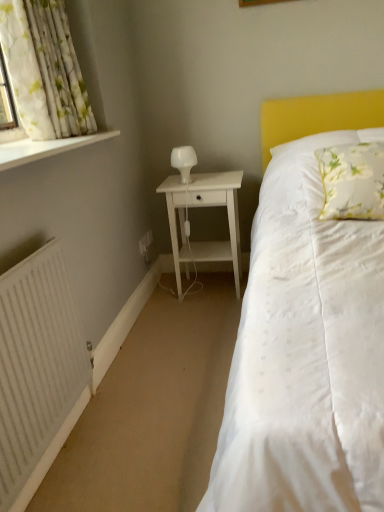
Question: Is there a large distance between white glossy table lamp at center and white painted wood at left?

Choices:
 (A) yes
 (B) no

Answer: (B)

Question: From a real-world perspective, is white glossy table lamp at center beneath white painted wood at left?

Choices:
 (A) no
 (B) yes

Answer: (B)

Question: Can you confirm if white glossy table lamp at center is smaller than white painted wood at left?

Choices:
 (A) no
 (B) yes

Answer: (B)

Question: Is white glossy table lamp at center behind white painted wood at left?

Choices:
 (A) yes
 (B) no

Answer: (A)

Question: Is white glossy table lamp at center not inside white painted wood at left?

Choices:
 (A) no
 (B) yes

Answer: (B)

Question: Does point pyautogui.click(x=114, y=133) appear closer or farther from the camera than point pyautogui.click(x=79, y=109)?

Choices:
 (A) closer
 (B) farther

Answer: (B)

Question: From the image's perspective, is white painted wood at left positioned above or below white floral fabric curtain at upper left?

Choices:
 (A) above
 (B) below

Answer: (B)

Question: Considering the positions of white painted wood at left and white floral fabric curtain at upper left in the image, is white painted wood at left bigger or smaller than white floral fabric curtain at upper left?

Choices:
 (A) small
 (B) big

Answer: (A)

Question: Is white painted wood at left inside the boundaries of white floral fabric curtain at upper left, or outside?

Choices:
 (A) outside
 (B) inside

Answer: (A)

Question: In terms of size, does white wood nightstand at center appear bigger or smaller than white glossy table lamp at center?

Choices:
 (A) small
 (B) big

Answer: (B)

Question: Considering the positions of point (175, 268) and point (175, 154), is point (175, 268) closer or farther from the camera than point (175, 154)?

Choices:
 (A) closer
 (B) farther

Answer: (A)

Question: Would you say white wood nightstand at center is to the left or to the right of white glossy table lamp at center in the picture?

Choices:
 (A) left
 (B) right

Answer: (B)

Question: From the image's perspective, is white wood nightstand at center positioned above or below white glossy table lamp at center?

Choices:
 (A) below
 (B) above

Answer: (A)

Question: From the image's perspective, is white floral fabric curtain at upper left positioned above or below white wood nightstand at center?

Choices:
 (A) above
 (B) below

Answer: (A)

Question: Would you say white floral fabric curtain at upper left is to the left or to the right of white wood nightstand at center in the picture?

Choices:
 (A) left
 (B) right

Answer: (A)